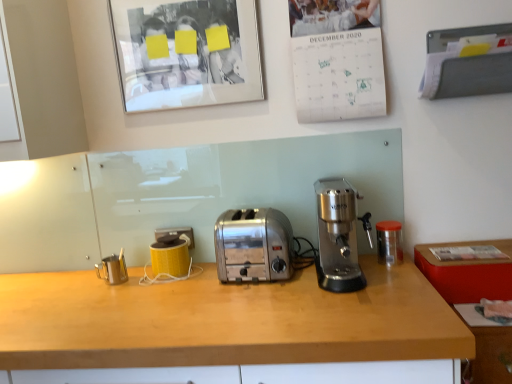
The image size is (512, 384). What are the coordinates of `free space in front of brushed metal milk frother at left, the third appliance positioned from the right` in the screenshot? It's located at click(x=98, y=295).